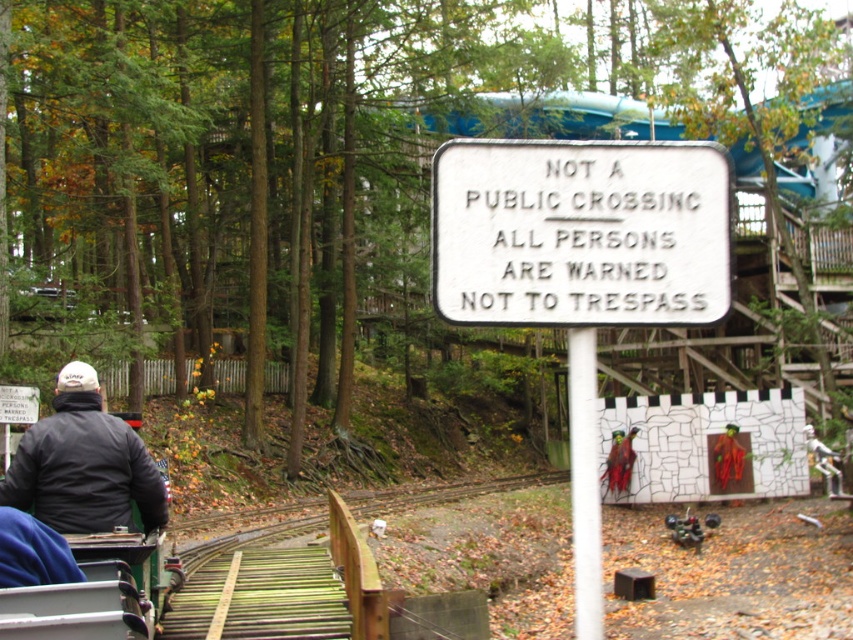
This screenshot has height=640, width=853. Describe the element at coordinates (267, 588) in the screenshot. I see `wooden at center` at that location.

Does wooden at center have a lesser width compared to dark gray jacket at lower left?

Incorrect, wooden at center's width is not less than dark gray jacket at lower left's.

Locate an element on the screen. This screenshot has height=640, width=853. wooden at center is located at coordinates (267, 588).

In the scene shown: Does white paper sign at center appear over wooden at center?

Yes.

Between white paper sign at center and wooden at center, which one appears on the left side from the viewer's perspective?

Positioned to the left is wooden at center.

What do you see at coordinates (579, 268) in the screenshot? Image resolution: width=853 pixels, height=640 pixels. I see `white paper sign at center` at bounding box center [579, 268].

What are the coordinates of `white paper sign at center` in the screenshot? It's located at (579, 268).

Can you confirm if white paper sign at center is thinner than dark gray jacket at lower left?

Correct, white paper sign at center's width is less than dark gray jacket at lower left's.

Does point (473, 170) come farther from viewer compared to point (97, 493)?

No, (473, 170) is in front of (97, 493).

This screenshot has width=853, height=640. Find the location of `white paper sign at center`. white paper sign at center is located at coordinates (579, 268).